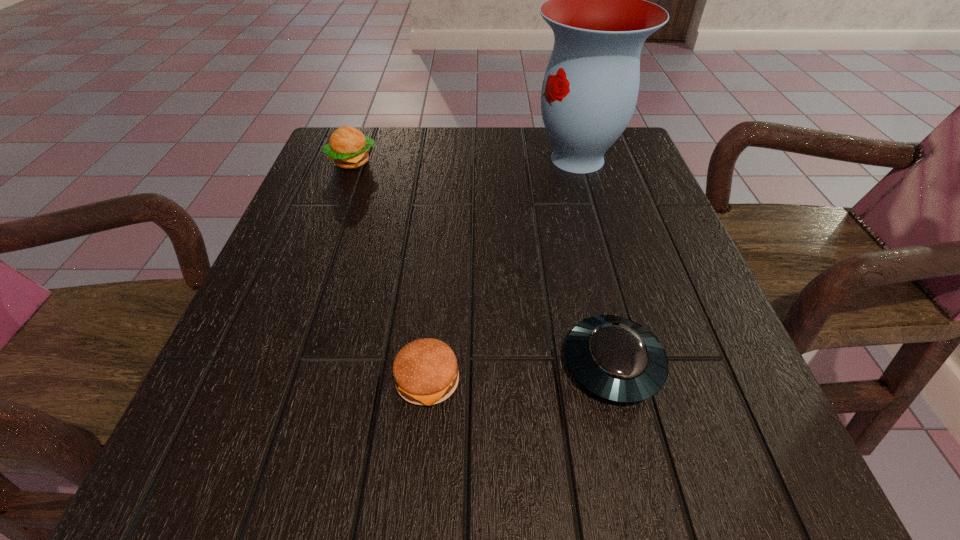
Image resolution: width=960 pixels, height=540 pixels. I want to click on vase, so click(x=596, y=7).

The height and width of the screenshot is (540, 960). What are the coordinates of `the left hamburger` in the screenshot? It's located at (349, 148).

Identify the location of the leftmost object. (349, 148).

I want to click on the second object from left to right, so click(x=425, y=371).

Identify the location of the nearer hamburger. The image size is (960, 540). (425, 371).

Where is `saucer`? The height and width of the screenshot is (540, 960). saucer is located at coordinates (614, 358).

What are the coordinates of `vacant space situated 0.120m on the front of the tallest object` in the screenshot? It's located at coord(595,221).

The image size is (960, 540). Find the location of `free point located on the right of the taller hamburger`. free point located on the right of the taller hamburger is located at coordinates 429,162.

At what (x,y) coordinates should I click in order to perform the action: click on vacant space located on the back of the shorter hamburger. Please return your answer as a coordinate pair (x, y). Looking at the image, I should click on (444, 200).

The image size is (960, 540). I want to click on vacant space situated on the back of the saucer, so click(570, 191).